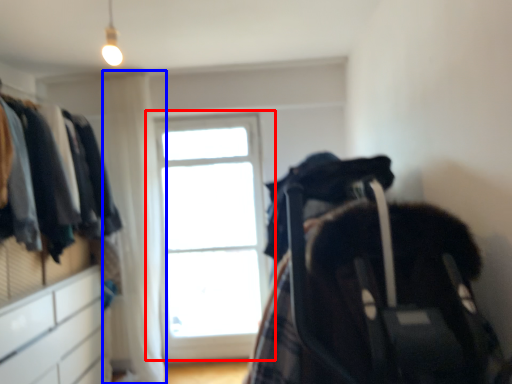
Question: Which object is further to the camera taking this photo, window (highlighted by a red box) or curtain (highlighted by a blue box)?

Choices:
 (A) window
 (B) curtain

Answer: (A)